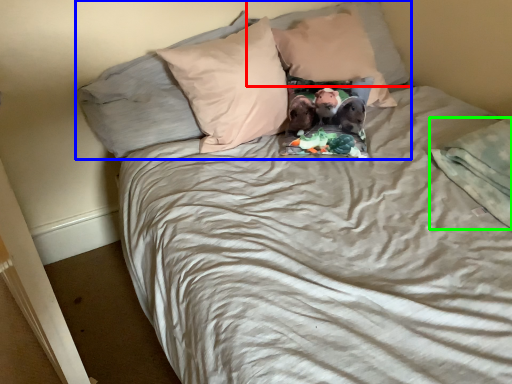
Question: Estimate the real-world distances between objects in this image. Which object is farther from pillow (highlighted by a red box), pillow (highlighted by a blue box) or blanket (highlighted by a green box)?

Choices:
 (A) pillow
 (B) blanket

Answer: (B)